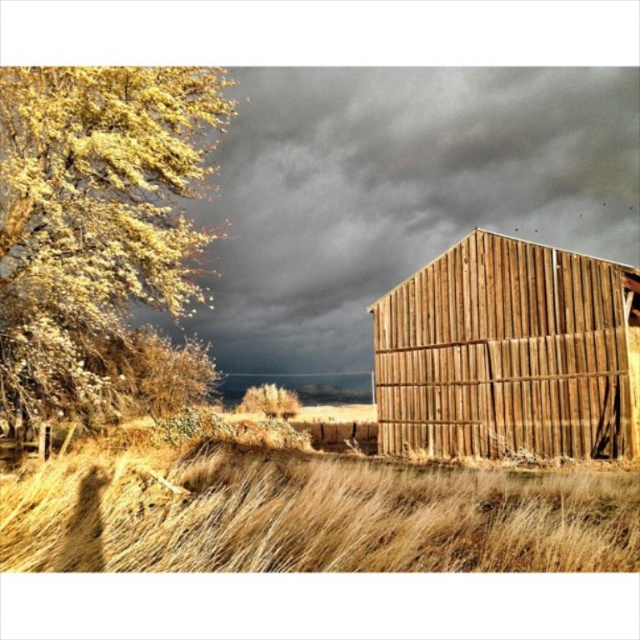
Based on the scene description, where are the golden textured leaves at left located in relation to the barn?

The golden textured leaves at left are located to the left of the barn.